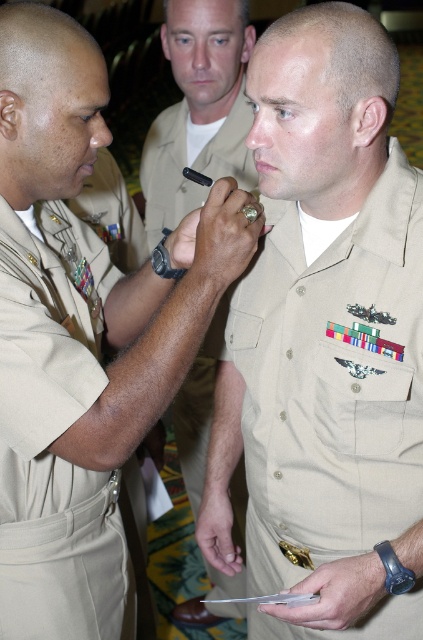
Does tan/khaki fabric uniform at left appear on the left side of matte khaki uniform at center?

Yes, tan/khaki fabric uniform at left is to the left of matte khaki uniform at center.

Does tan/khaki fabric uniform at left appear under matte khaki uniform at center?

Correct, tan/khaki fabric uniform at left is located below matte khaki uniform at center.

Between point (74, 616) and point (189, 8), which one is positioned in front?

Point (74, 616) is in front.

At what (x,y) coordinates should I click in order to perform the action: click on tan/khaki fabric uniform at left. Please return your answer as a coordinate pair (x, y). The image size is (423, 640). Looking at the image, I should click on (54, 438).

Between point (271, 484) and point (198, 461), which one is positioned in front?

Point (271, 484)

Can you confirm if tan uniform at center is bigger than matte khaki uniform at center?

Correct, tan uniform at center is larger in size than matte khaki uniform at center.

Is point (412, 484) positioned in front of point (183, 42)?

Yes, it is in front of point (183, 42).

Locate an element on the screen. This screenshot has height=640, width=423. tan uniform at center is located at coordinates (332, 384).

Based on the photo, is tan uniform shirt at center bigger than matte khaki uniform at center?

Yes, tan uniform shirt at center is bigger than matte khaki uniform at center.

Measure the distance between tan uniform shirt at center and camera.

tan uniform shirt at center is 1.08 meters from camera.

Is point (217, 208) more distant than point (170, 173)?

No, it is in front of (170, 173).

In order to click on tan uniform shirt at center in this screenshot , I will do `click(96, 268)`.